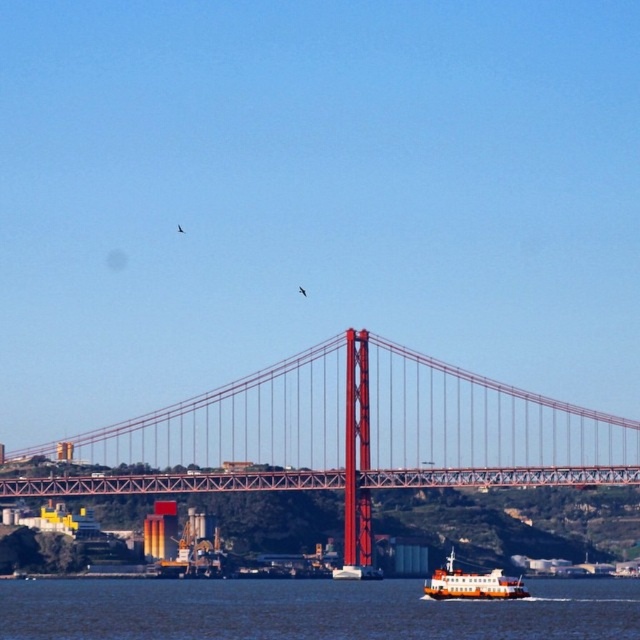
Which of these two, metallic red suspension bridge at center or blue water at lower center, stands taller?

metallic red suspension bridge at center is taller.

Does point (129, 472) come farther from viewer compared to point (625, 580)?

That is False.

Which is behind, point (368, 484) or point (128, 612)?

The point (128, 612) is behind.

Locate an element on the screen. metallic red suspension bridge at center is located at coordinates (346, 436).

Who is positioned more to the left, blue water at lower center or orange matte ferryboat at lower center?

Positioned to the left is blue water at lower center.

Is blue water at lower center taller than orange matte ferryboat at lower center?

Indeed, blue water at lower center has a greater height compared to orange matte ferryboat at lower center.

Find the location of a particular element. Image resolution: width=640 pixels, height=640 pixels. blue water at lower center is located at coordinates (308, 611).

Find the location of a particular element. The height and width of the screenshot is (640, 640). blue water at lower center is located at coordinates (308, 611).

Does metallic red suspension bridge at center have a greater height compared to orange matte ferryboat at lower center?

Yes, metallic red suspension bridge at center is taller than orange matte ferryboat at lower center.

Can you confirm if metallic red suspension bridge at center is positioned above orange matte ferryboat at lower center?

Yes.

Identify the location of metallic red suspension bridge at center. (346, 436).